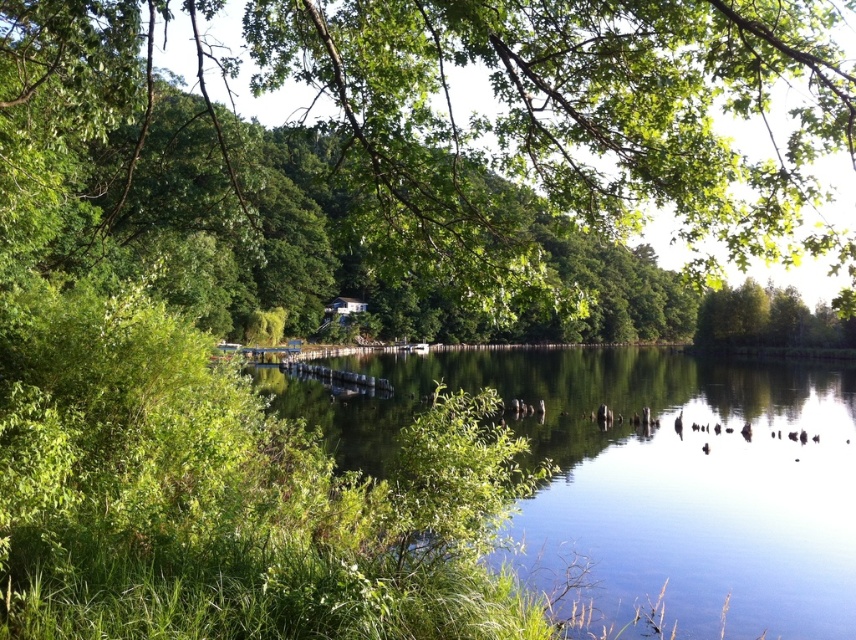
Question: Which point is closer to the camera taking this photo?

Choices:
 (A) tap(788, 458)
 (B) tap(340, 257)

Answer: (A)

Question: Which point is closer to the camera?

Choices:
 (A) (583, 58)
 (B) (789, 477)

Answer: (A)

Question: Is green leafy tree at upper center above clear water at center?

Choices:
 (A) yes
 (B) no

Answer: (A)

Question: Can you confirm if green leafy tree at upper center is smaller than clear water at center?

Choices:
 (A) no
 (B) yes

Answer: (A)

Question: Is green leafy tree at upper center positioned in front of clear water at center?

Choices:
 (A) no
 (B) yes

Answer: (B)